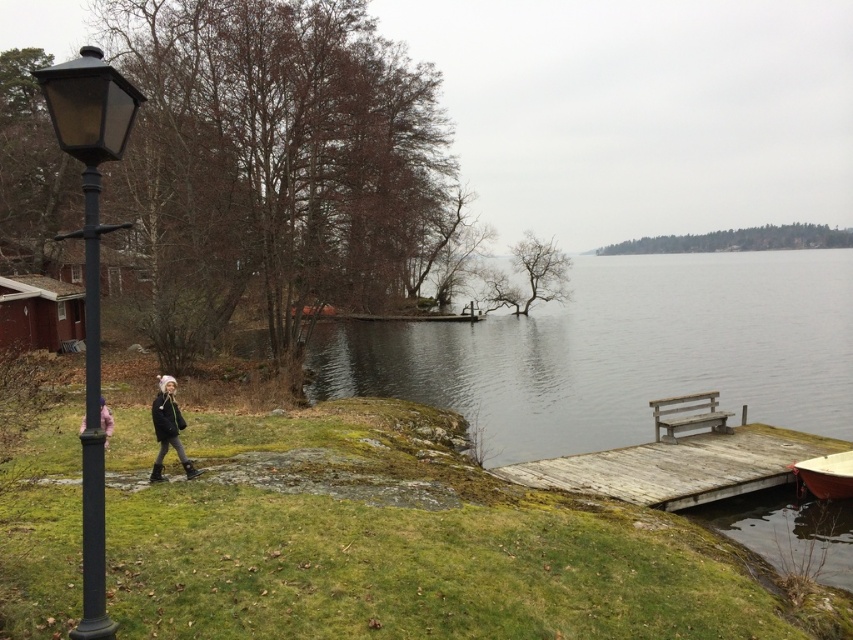
You are standing at the point marked as point (91, 276). What object is located at that point?

The black metal lamp post at left is located at point (91, 276).

You are standing at the edge of the lake and want to place a small floating dock between the smooth gray water at center and the white wooden boat at lower right. Based on their positions, which object should the dock be placed closer to?

The dock should be placed closer to the white wooden boat at lower right because the smooth gray water at center is to the right of the white wooden boat at lower right, meaning the boat is positioned to the left of the water. Therefore, placing the dock closer to the boat would position it between them.